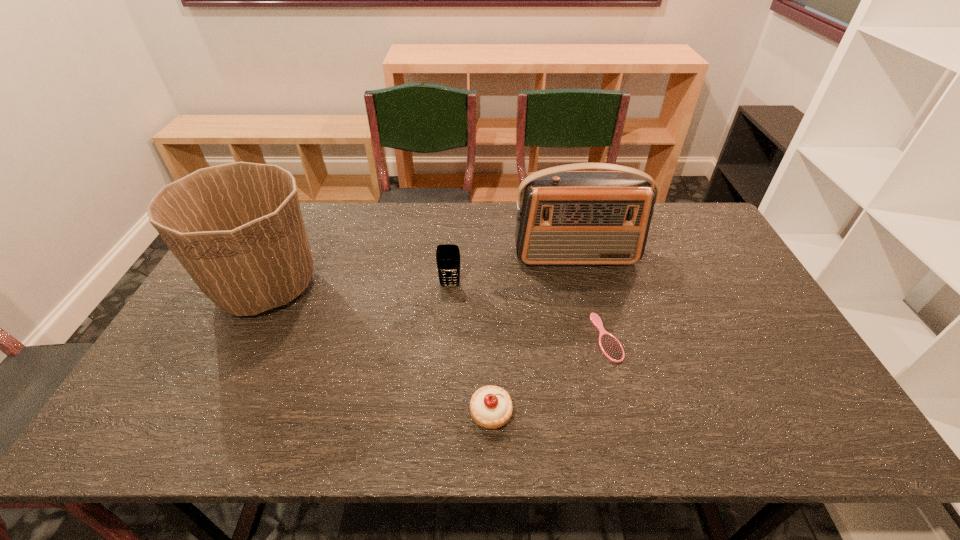
Where is `vacant space located 0.150m on the back of the pastry`? This screenshot has height=540, width=960. vacant space located 0.150m on the back of the pastry is located at coordinates (490, 344).

I want to click on free region located on the front of the shortest object, so click(634, 438).

Locate an element on the screen. The height and width of the screenshot is (540, 960). object that is at the far edge is located at coordinates (565, 217).

Find the location of a particular element. object at the near edge is located at coordinates (491, 407).

Find the location of a particular element. Image resolution: width=960 pixels, height=540 pixels. object present at the left edge is located at coordinates (237, 229).

This screenshot has width=960, height=540. Identify the location of free region at the far edge. (423, 209).

In the image, there is a desktop. Find the location of `free space at the right edge`. free space at the right edge is located at coordinates (691, 273).

At what (x,y) coordinates should I click in order to perform the action: click on blank space at the far right corner of the desktop. Please return your answer as a coordinate pair (x, y). The image size is (960, 540). Looking at the image, I should click on (701, 242).

I want to click on blank region between the radio receiver and the cellular telephone, so click(x=513, y=271).

Locate an element on the screen. This screenshot has height=540, width=960. free space between the radio receiver and the shortest object is located at coordinates (591, 297).